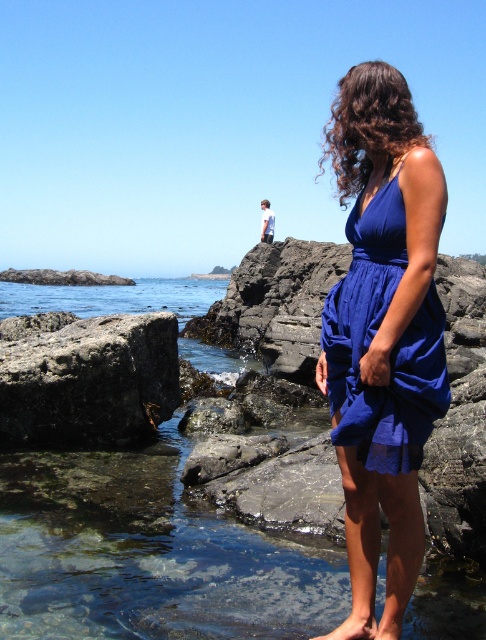
You are a photographer planning to capture the woman in the royal blue dress standing on the rocky terrain. You want to ensure that both the rusty metal rock at lower left and the clear water at lower left are visible in your shot. Based on their sizes, which object will appear larger in the photo?

The clear water at lower left appears larger in the photo because the rusty metal rock at lower left is not as tall as it, making the water take up more visual space.

You are a photographer planning to capture a wide shot of the coastal scene. You need to ensure that both the clear water at rock center and the clear water at lower left are in focus simultaneously. Given that your camera has a depth of field that can cover 25 meters, will you be able to achieve this?

The clear water at rock center and the clear water at lower left are 23.41 meters apart. Since the distance between them is within the camera depth of field coverage of 25 meters, you can achieve both in focus simultaneously.